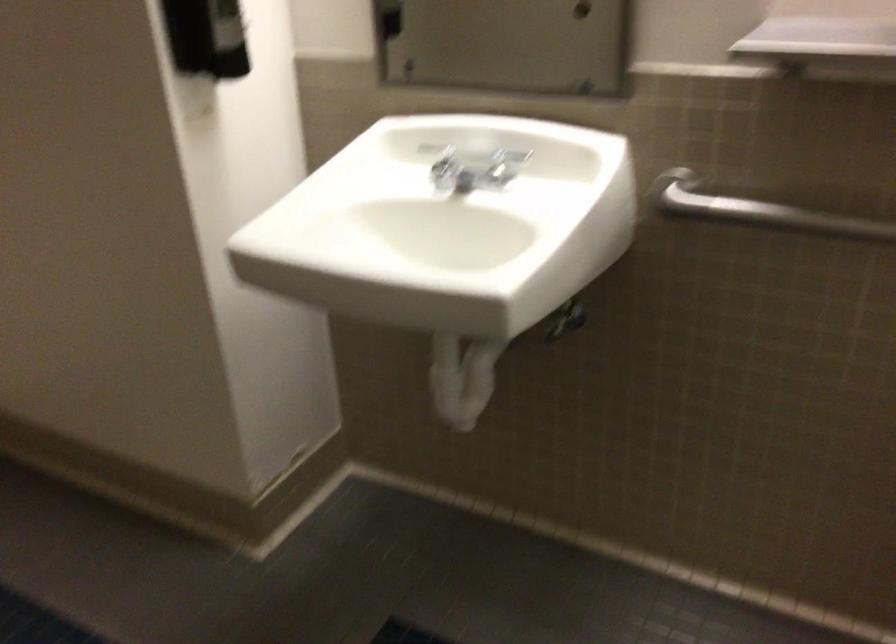
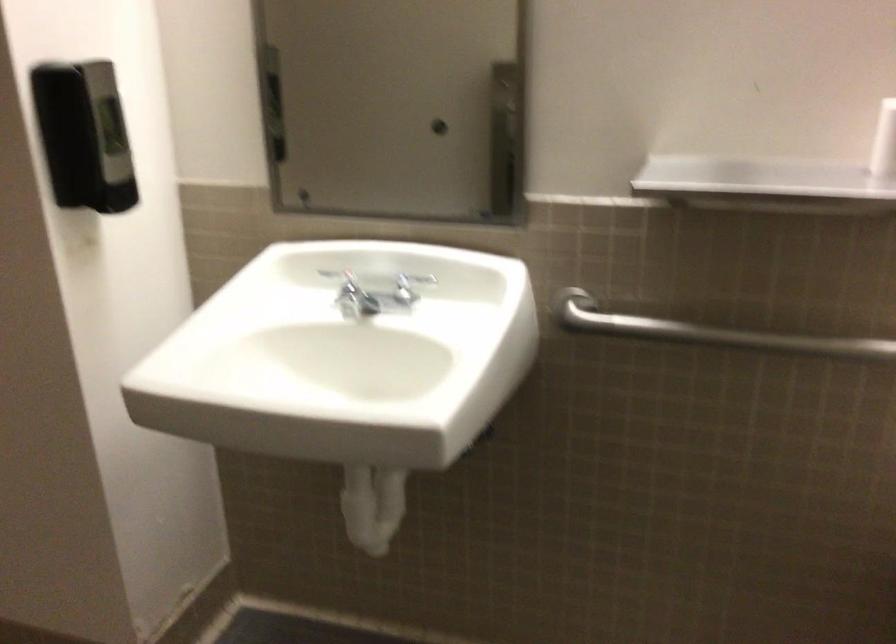
Question: Which direction would the cameraman need to move to produce the second image? Reply with the corresponding letter.

Choices:
 (A) Left
 (B) Right
 (C) Forward
 (D) Backward

Answer: (A)